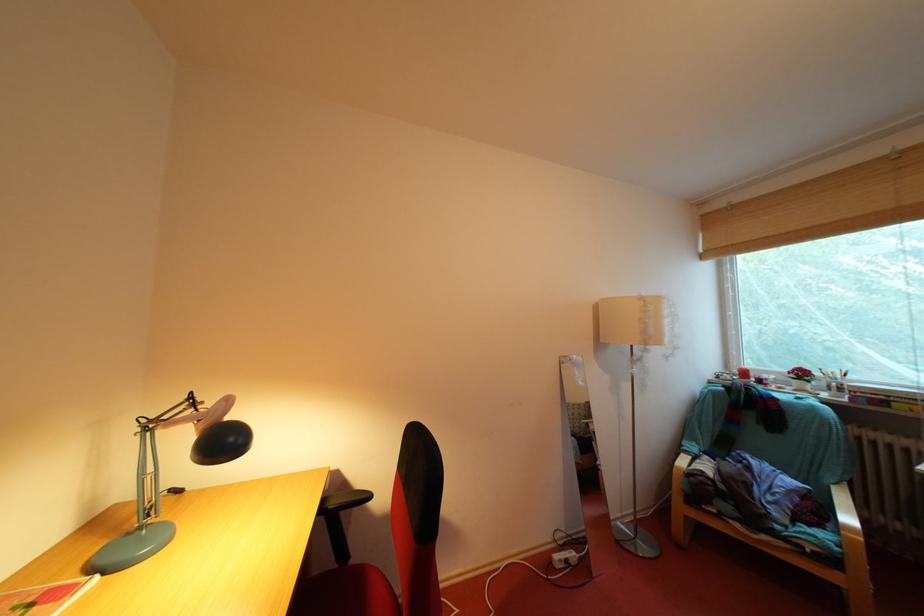
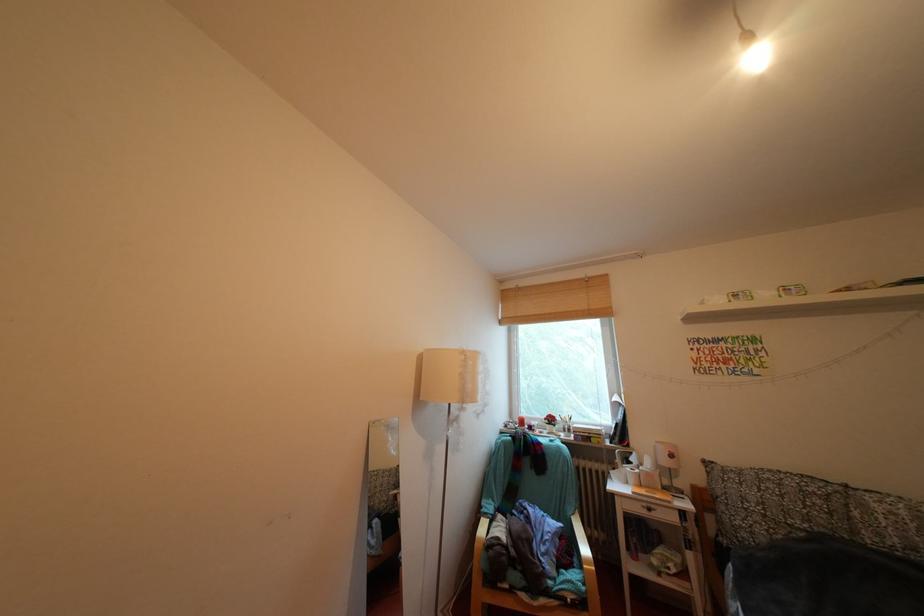
Question: The camera is either moving clockwise (left) or counter-clockwise (right) around the object. The first image is from the beginning of the video and the second image is from the end. Is the camera moving left or right when shooting the video?

Choices:
 (A) Left
 (B) Right

Answer: (A)